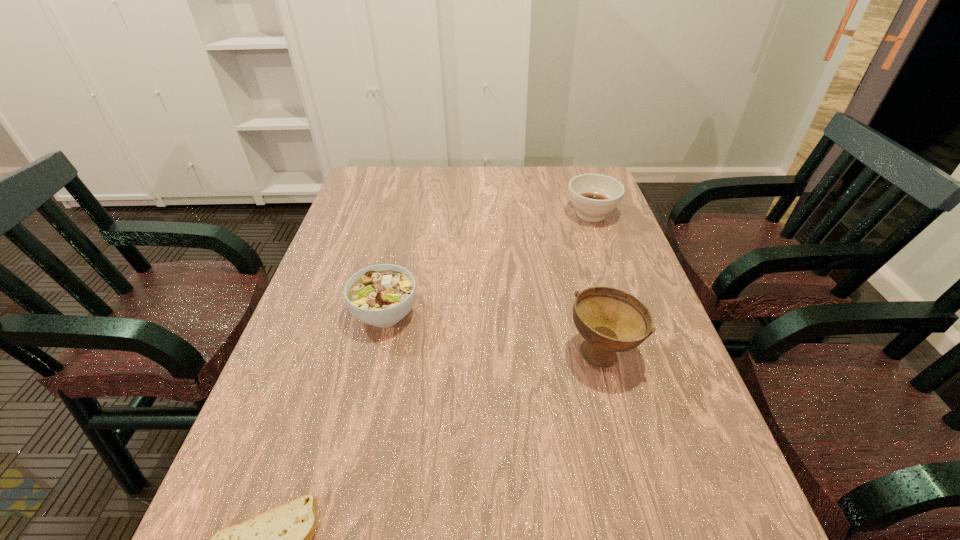
Where is `the tallest object`? This screenshot has width=960, height=540. the tallest object is located at coordinates (610, 320).

Locate an element on the screen. This screenshot has width=960, height=540. the farthest soup bowl is located at coordinates (593, 195).

This screenshot has height=540, width=960. What are the coordinates of `the leftmost soup bowl` in the screenshot? It's located at (381, 295).

At what (x,y) coordinates should I click in order to perform the action: click on vacant region located 0.260m on the front of the tallest soup bowl. Please return your answer as a coordinate pair (x, y). The width and height of the screenshot is (960, 540). Looking at the image, I should click on tap(646, 518).

What are the coordinates of `free space located on the left of the farthest object` in the screenshot? It's located at (472, 214).

At what (x,y) coordinates should I click in order to perform the action: click on vacant space located 0.080m on the front of the leftmost soup bowl. Please return your answer as a coordinate pair (x, y). The height and width of the screenshot is (540, 960). Looking at the image, I should click on click(x=373, y=368).

Locate an element on the screen. The width and height of the screenshot is (960, 540). object at the far edge is located at coordinates (593, 195).

Locate an element on the screen. object located at the left edge is located at coordinates (381, 295).

Locate an element on the screen. object positioned at the far right corner is located at coordinates (593, 195).

In order to click on free space at the far edge of the desktop in this screenshot , I will do `click(515, 192)`.